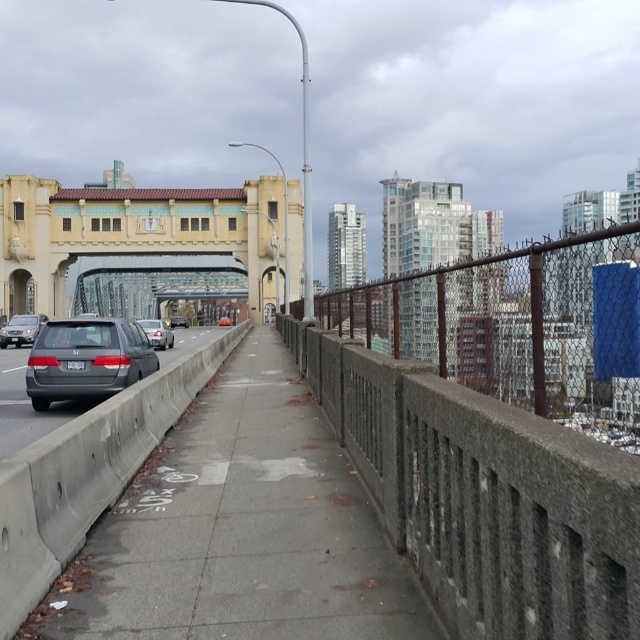
Question: Does rusty chain-link fence at center-right appear on the left side of matte gray sedan at left?

Choices:
 (A) no
 (B) yes

Answer: (A)

Question: Considering the relative positions of matte gray minivan at left and matte gray car at left in the image provided, where is matte gray minivan at left located with respect to matte gray car at left?

Choices:
 (A) left
 (B) right

Answer: (B)

Question: Observing the image, what is the correct spatial positioning of rusty chain-link fence at center-right in reference to matte gray car at left?

Choices:
 (A) above
 (B) below

Answer: (A)

Question: Estimate the real-world distances between objects in this image. Which object is farther from the matte gray car at left?

Choices:
 (A) gray concrete sidewalk at center
 (B) matte silver sedan at center
 (C) matte gray sedan at left
 (D) rusty chain-link fence at center-right

Answer: (D)

Question: Which of the following is the farthest from the observer?

Choices:
 (A) (276, 360)
 (B) (3, 344)

Answer: (B)

Question: Which object appears farthest from the camera in this image?

Choices:
 (A) matte gray sedan at left
 (B) beige concrete bridge at center
 (C) matte silver sedan at center
 (D) matte gray minivan at left

Answer: (B)